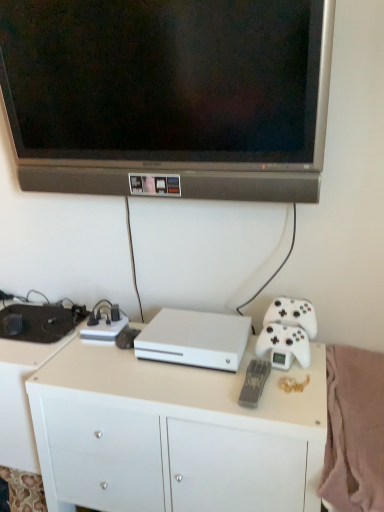
Question: Can you confirm if white matte console at center is smaller than white matte game controller at right?

Choices:
 (A) yes
 (B) no

Answer: (B)

Question: Is white matte console at center further to the viewer compared to white matte game controller at right?

Choices:
 (A) no
 (B) yes

Answer: (A)

Question: Is white matte console at center wider than white matte game controller at right?

Choices:
 (A) yes
 (B) no

Answer: (A)

Question: Does white matte console at center appear on the right side of white matte game controller at right?

Choices:
 (A) no
 (B) yes

Answer: (A)

Question: Could you tell me if white matte console at center is facing white matte game controller at right?

Choices:
 (A) yes
 (B) no

Answer: (B)

Question: Is there a large distance between white matte console at center and white matte game controller at right?

Choices:
 (A) yes
 (B) no

Answer: (B)

Question: Considering the relative sizes of soft pink fleece blanket at lower right and white matte game controller at right in the image provided, is soft pink fleece blanket at lower right bigger than white matte game controller at right?

Choices:
 (A) yes
 (B) no

Answer: (A)

Question: From the image's perspective, is soft pink fleece blanket at lower right located beneath white matte game controller at right?

Choices:
 (A) no
 (B) yes

Answer: (B)

Question: Does soft pink fleece blanket at lower right lie in front of white matte game controller at right?

Choices:
 (A) no
 (B) yes

Answer: (B)

Question: From a real-world perspective, is soft pink fleece blanket at lower right physically below white matte game controller at right?

Choices:
 (A) yes
 (B) no

Answer: (A)

Question: From the image's perspective, is soft pink fleece blanket at lower right over white matte game controller at right?

Choices:
 (A) no
 (B) yes

Answer: (A)

Question: Does soft pink fleece blanket at lower right come behind white matte game controller at right?

Choices:
 (A) no
 (B) yes

Answer: (A)

Question: Is the depth of white matte game controller at right less than that of white matte console at center?

Choices:
 (A) no
 (B) yes

Answer: (A)